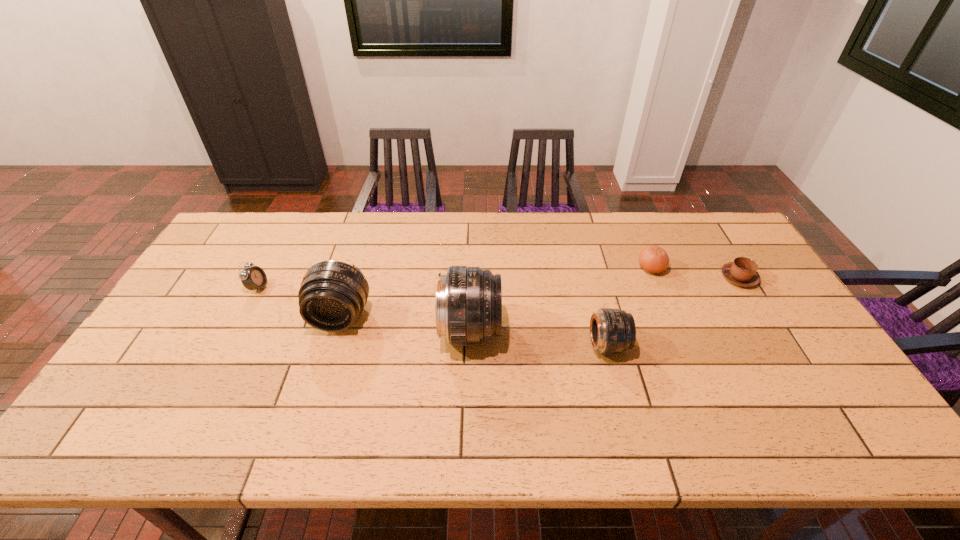
With all telephoto lenss evenly spaced, where should an extra telephoto lens be placed on the right to continue the pattern? Please point out a vacant space. Please provide its 2D coordinates. Your answer should be formatted as a tuple, i.e. [(x, y)], where the tuple contains the x and y coordinates of a point satisfying the conditions above.

[(754, 360)]